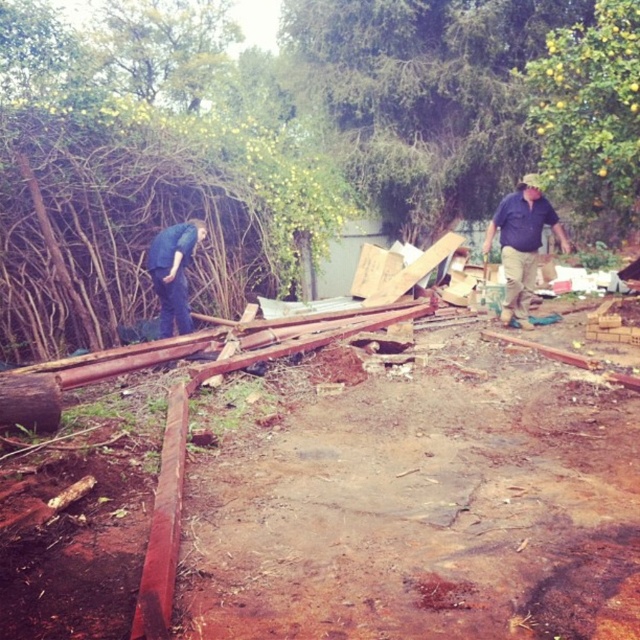
Can you confirm if matte blue shirt at right is wider than blue jeans at left?

Indeed, matte blue shirt at right has a greater width compared to blue jeans at left.

Is matte blue shirt at right positioned behind blue jeans at left?

Yes, it is behind blue jeans at left.

Between point (529, 209) and point (170, 292), which one is positioned behind?

The point (529, 209) is behind.

I want to click on matte blue shirt at right, so tap(522, 243).